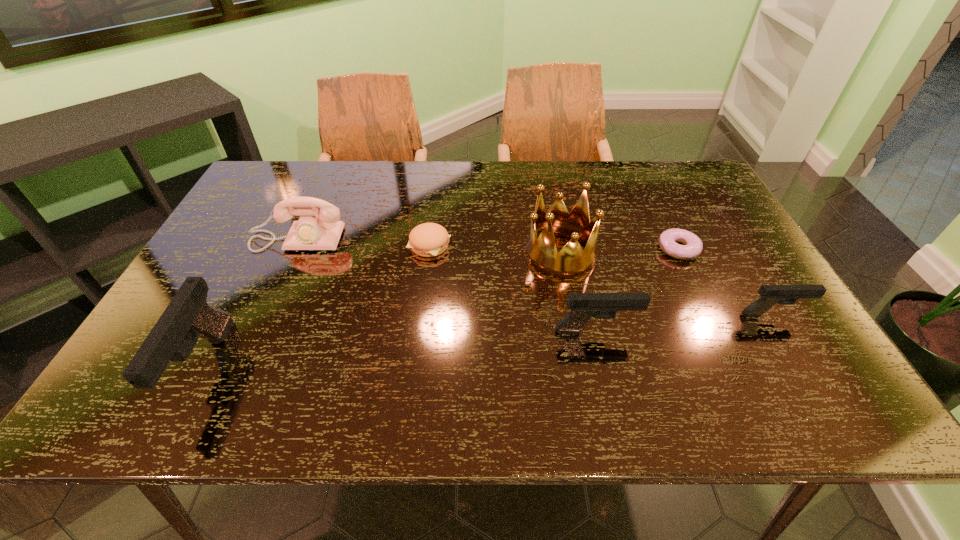
Identify the location of crown. This screenshot has width=960, height=540. (542, 253).

Find the location of a particular element. The width and height of the screenshot is (960, 540). vacant point located on the front-facing side of the second pistol from left to right is located at coordinates (x=779, y=331).

Where is `vacant space located on the right of the third object from left to right`? The width and height of the screenshot is (960, 540). vacant space located on the right of the third object from left to right is located at coordinates (472, 246).

You are a GUI agent. You are given a task and a screenshot of the screen. Output one action in this format:
    pyautogui.click(x=<x>, y=<y>)
    Task: Click on the vacant region located 0.370m on the back of the shortest object
    Image resolution: width=960 pixels, height=540 pixels.
    Given the screenshot: What is the action you would take?
    638,166

Identify the location of vacant space situated on the dial of the telephone. (255, 333).

Find the location of `blank area located on the back of the crown`. blank area located on the back of the crown is located at coordinates (546, 179).

You are a GUI agent. You are given a task and a screenshot of the screen. Output one action in this format:
    pyautogui.click(x=<x>, y=<y>)
    Task: Click on the object that is at the near edge
    Image resolution: width=960 pixels, height=540 pixels.
    Given the screenshot: What is the action you would take?
    pos(188,316)

Identify the location of pistol located in the left edge section of the desktop. (188, 316).

Locate an element on the screen. telephone that is at the left edge is located at coordinates (311, 232).

In order to click on pistol located at the right edge in this screenshot , I will do `click(770, 295)`.